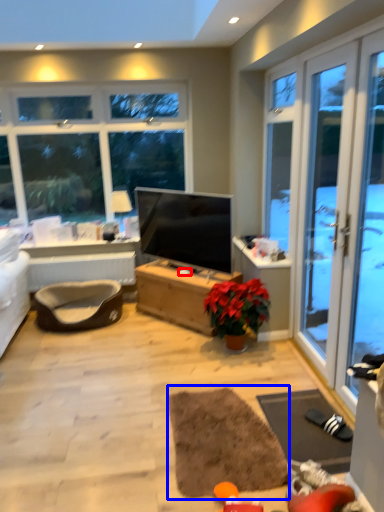
Question: Among these objects, which one is nearest to the camera, loudspeaker (highlighted by a red box) or yoga mat (highlighted by a blue box)?

Choices:
 (A) loudspeaker
 (B) yoga mat

Answer: (B)